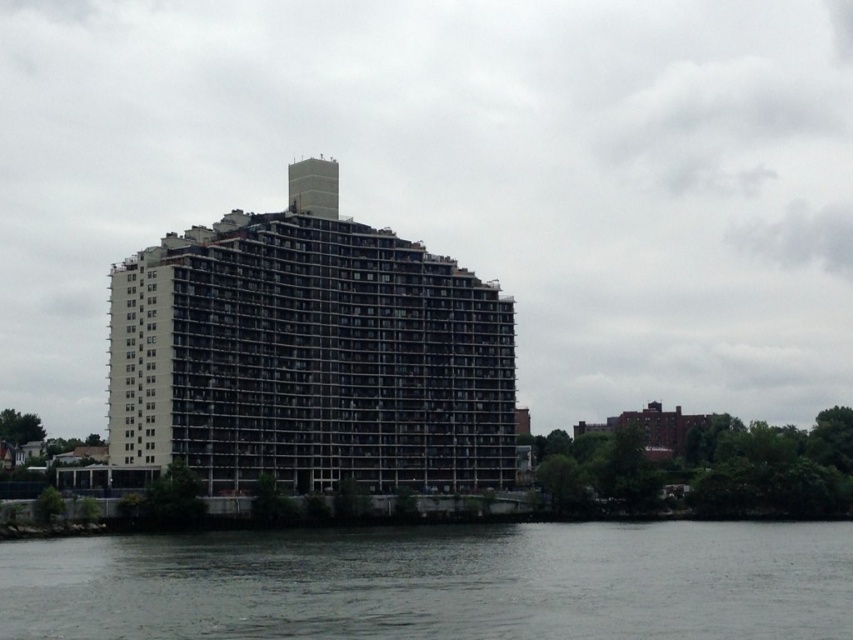
Is gray concrete building at center taller than gray water at lower center?

Yes.

Can you confirm if gray concrete building at center is thinner than gray water at lower center?

Correct, gray concrete building at center's width is less than gray water at lower center's.

I want to click on gray concrete building at center, so click(x=309, y=355).